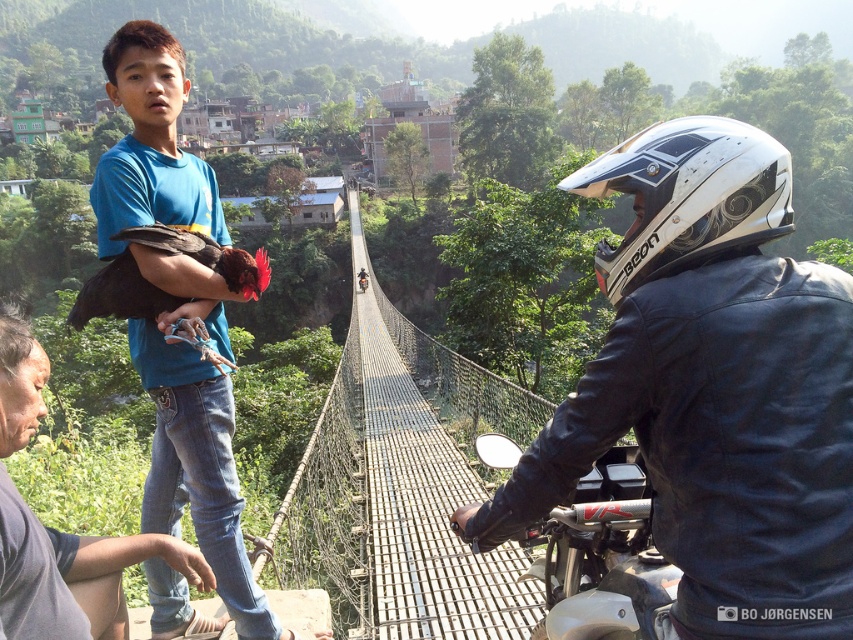
Question: Does blue cotton shirt at upper left have a smaller size compared to white matte motorcycle at center?

Choices:
 (A) no
 (B) yes

Answer: (A)

Question: Which of the following is the farthest from the observer?

Choices:
 (A) (779, 186)
 (B) (225, 516)
 (C) (654, 634)

Answer: (B)

Question: Does white matte helmet at upper center appear on the left side of blue cotton shirt at upper left?

Choices:
 (A) yes
 (B) no

Answer: (B)

Question: Which object is closer to the camera taking this photo?

Choices:
 (A) white matte helmet at upper center
 (B) blue cotton shirt at upper left

Answer: (A)

Question: Can you confirm if blue cotton shirt at upper left is positioned above white glossy helmet at upper right?

Choices:
 (A) no
 (B) yes

Answer: (A)

Question: Which of these objects is positioned closest to the white glossy helmet at upper right?

Choices:
 (A) white matte motorcycle at center
 (B) metallic wire mesh bridge at center
 (C) blue cotton shirt at upper left
 (D) white matte helmet at upper center

Answer: (A)